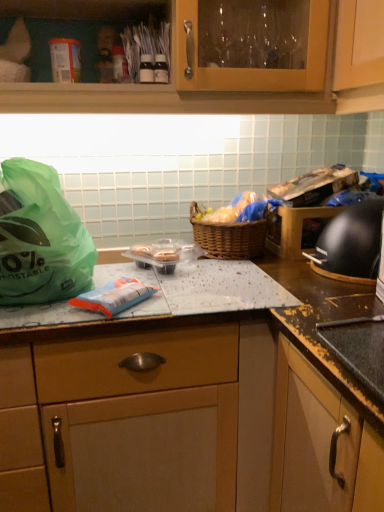
Where is `unoccupied area in front of woven brown picnic basket at center`? unoccupied area in front of woven brown picnic basket at center is located at coordinates (245, 276).